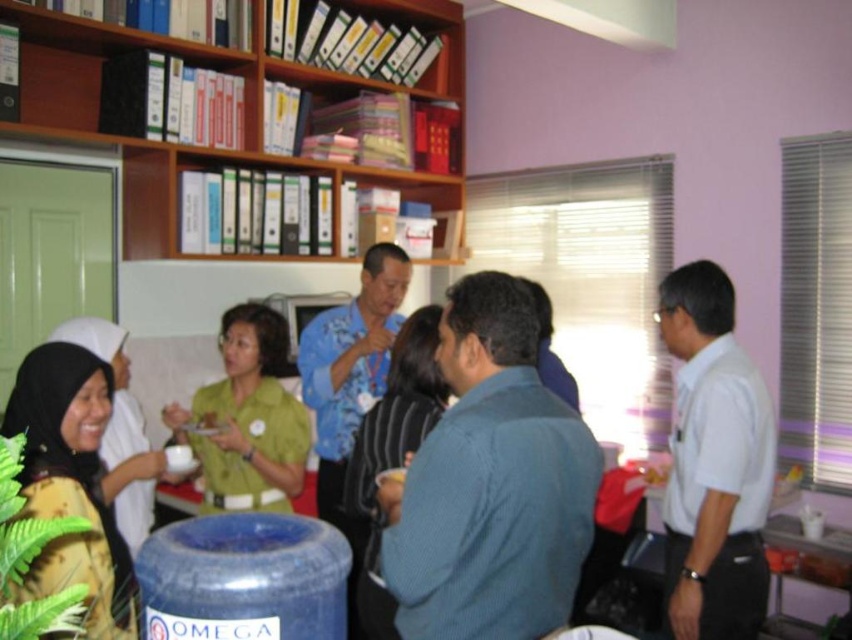
Can you confirm if white shirt at right is bigger than green matte shirt at center?

Actually, white shirt at right might be smaller than green matte shirt at center.

The height and width of the screenshot is (640, 852). What do you see at coordinates (712, 464) in the screenshot? I see `white shirt at right` at bounding box center [712, 464].

Who is more distant from viewer, (738, 420) or (280, 401)?

The point (280, 401) is behind.

Where is `white shirt at right`? This screenshot has height=640, width=852. white shirt at right is located at coordinates (712, 464).

Who is shorter, wooden bookshelf at upper center or white shirt at right?

Standing shorter between the two is white shirt at right.

Image resolution: width=852 pixels, height=640 pixels. In order to click on wooden bookshelf at upper center in this screenshot , I will do `click(200, 147)`.

Locate an element on the screen. The width and height of the screenshot is (852, 640). wooden bookshelf at upper center is located at coordinates point(200,147).

Does white shirt at right come in front of yellow printed fabric at lower left?

No, it is behind yellow printed fabric at lower left.

Is white shirt at right smaller than yellow printed fabric at lower left?

Yes, white shirt at right is smaller than yellow printed fabric at lower left.

Locate an element on the screen. Image resolution: width=852 pixels, height=640 pixels. white shirt at right is located at coordinates (712, 464).